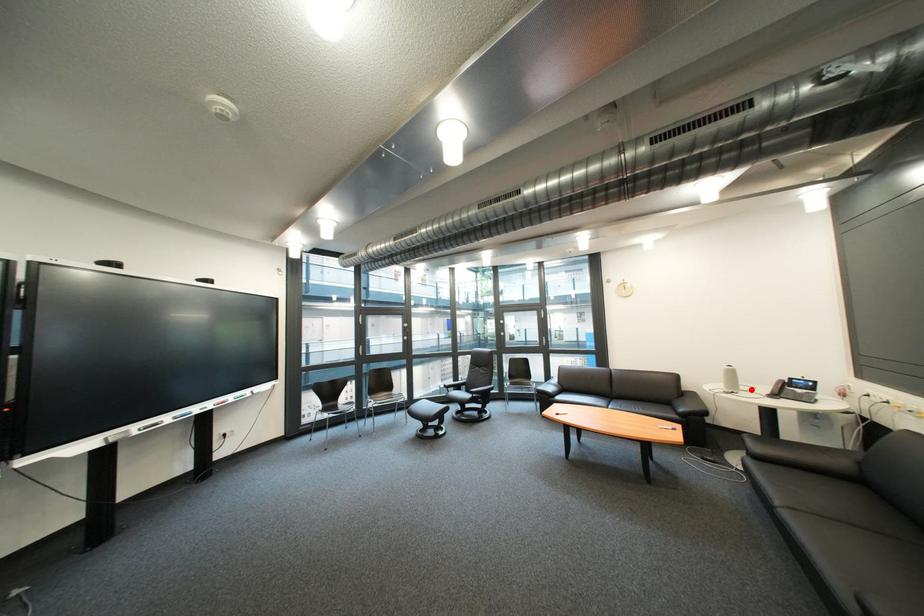
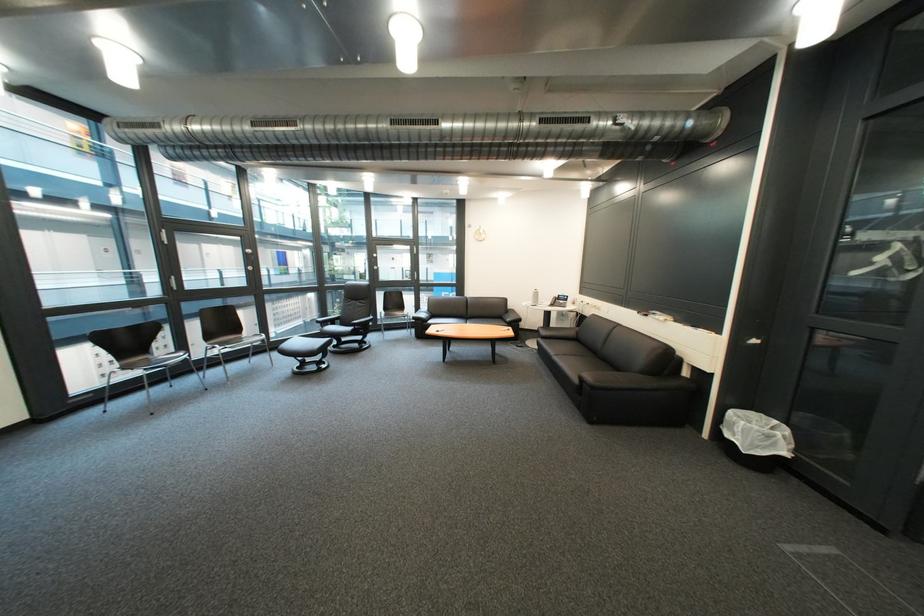
The point at the highlighted location is marked in the first image. Where is the corresponding point in the second image?

(552, 305)